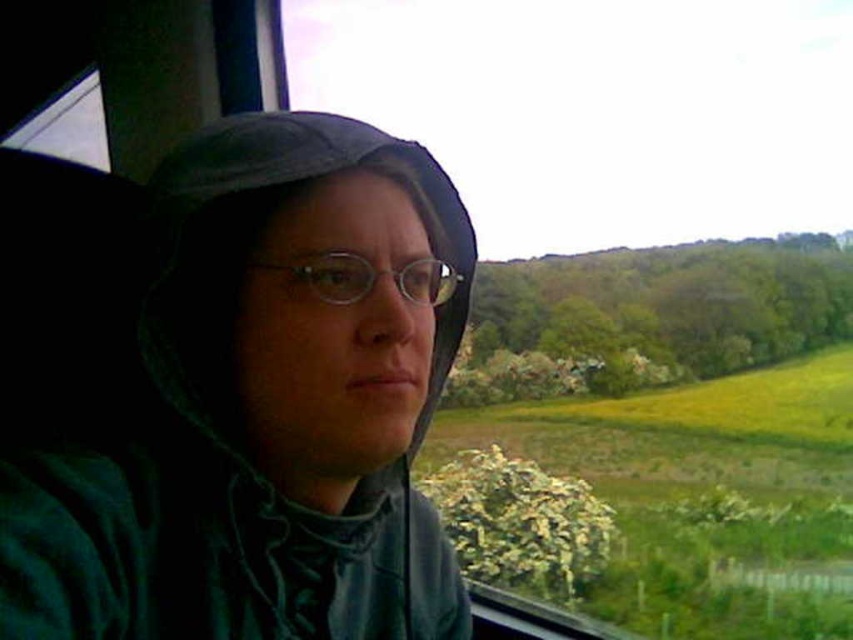
Which is behind, point (347, 512) or point (328, 301)?

The point (347, 512) is more distant.

Does green matte jacket at left have a greater width compared to clear plastic glasses at center?

Correct, the width of green matte jacket at left exceeds that of clear plastic glasses at center.

Who is more distant from viewer, (119, 275) or (440, 282)?

The point (119, 275) is behind.

Where is `green matte jacket at left`? The width and height of the screenshot is (853, 640). green matte jacket at left is located at coordinates (253, 403).